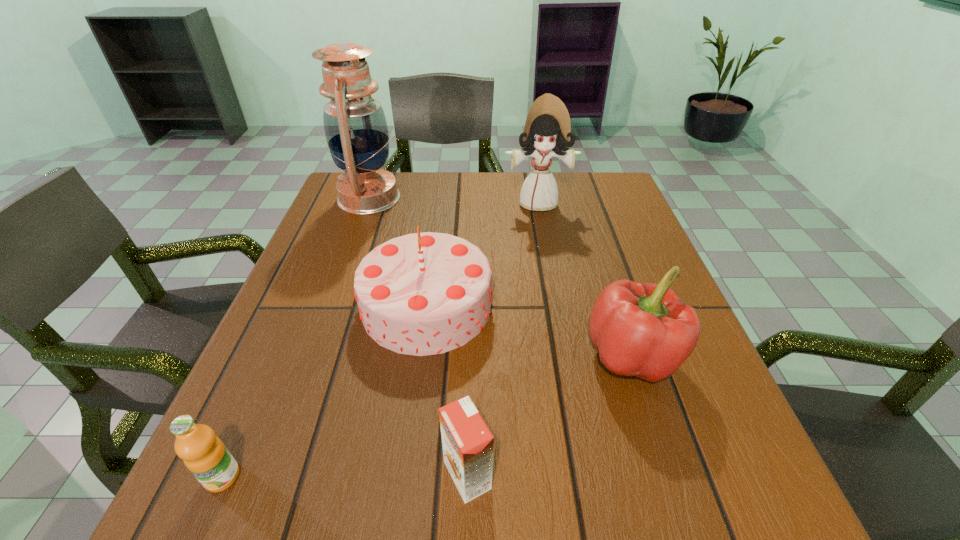
Locate an element on the screen. Image resolution: width=960 pixels, height=540 pixels. object present at the far right corner is located at coordinates (547, 126).

Locate an element on the screen. The height and width of the screenshot is (540, 960). blank space at the far edge is located at coordinates (453, 183).

In the image, there is a desktop. In order to click on vacant space at the near edge in this screenshot , I will do `click(540, 526)`.

The width and height of the screenshot is (960, 540). Identify the location of free spot at the left edge of the desktop. (331, 247).

Find the location of a particular element. vacant space at the right edge of the desktop is located at coordinates (652, 395).

You are a GUI agent. You are given a task and a screenshot of the screen. Output one action in this format:
    pyautogui.click(x=<x>, y=<y>)
    Task: Click on the vacant space at the near left corner of the desktop
    The image size is (960, 540).
    Given the screenshot: What is the action you would take?
    pyautogui.click(x=266, y=494)

This screenshot has height=540, width=960. Identify the location of free space at the far right corner of the desktop. (564, 178).

The height and width of the screenshot is (540, 960). Identify the location of vacant space that's between the oil lamp and the left orange juice. (296, 338).

The width and height of the screenshot is (960, 540). In order to click on free space between the left orange juice and the right orange juice in this screenshot , I will do `click(345, 476)`.

Find the location of a particular element. vacant space that's between the right orange juice and the left orange juice is located at coordinates (345, 476).